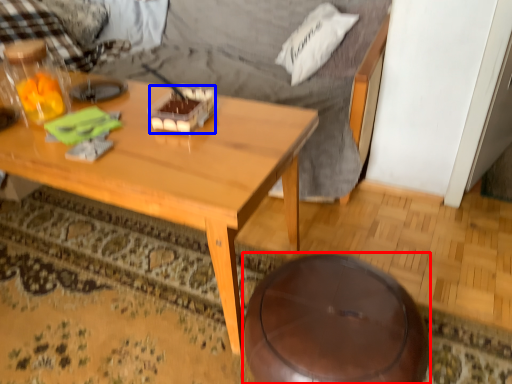
Question: Which of the following is the farthest to the observer, stool (highlighted by a red box) or food (highlighted by a blue box)?

Choices:
 (A) stool
 (B) food

Answer: (B)